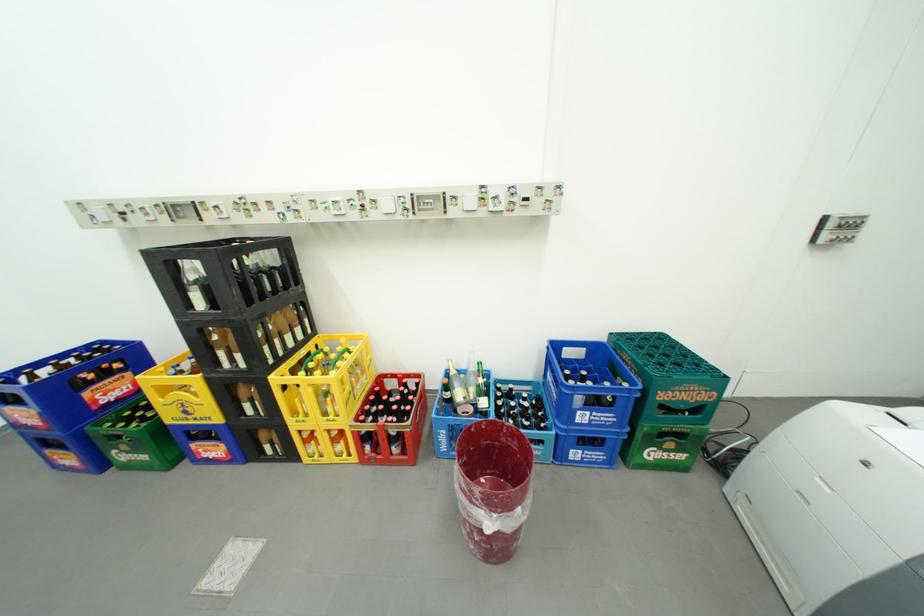
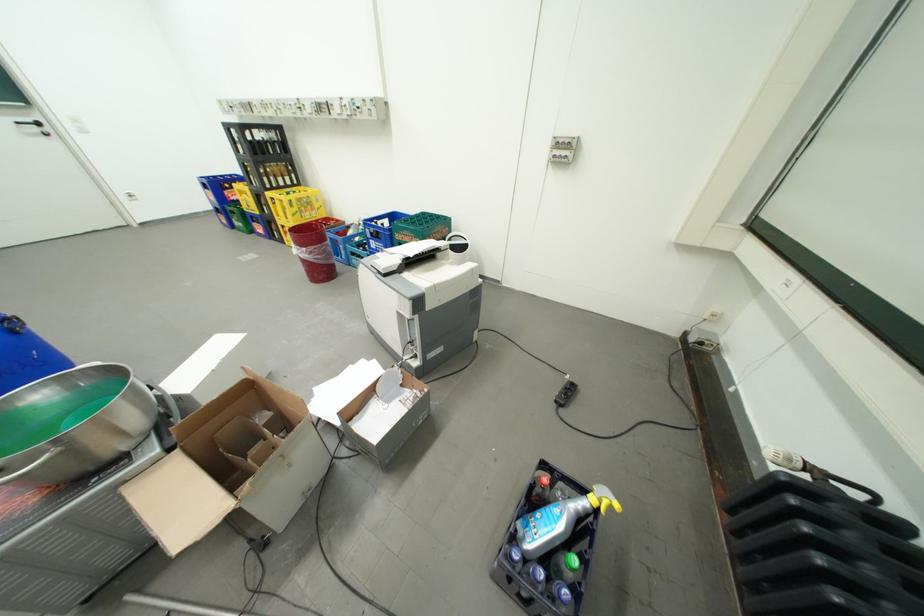
Find the pixel in the second image that matches the point at 716,392 in the first image.

(424, 238)